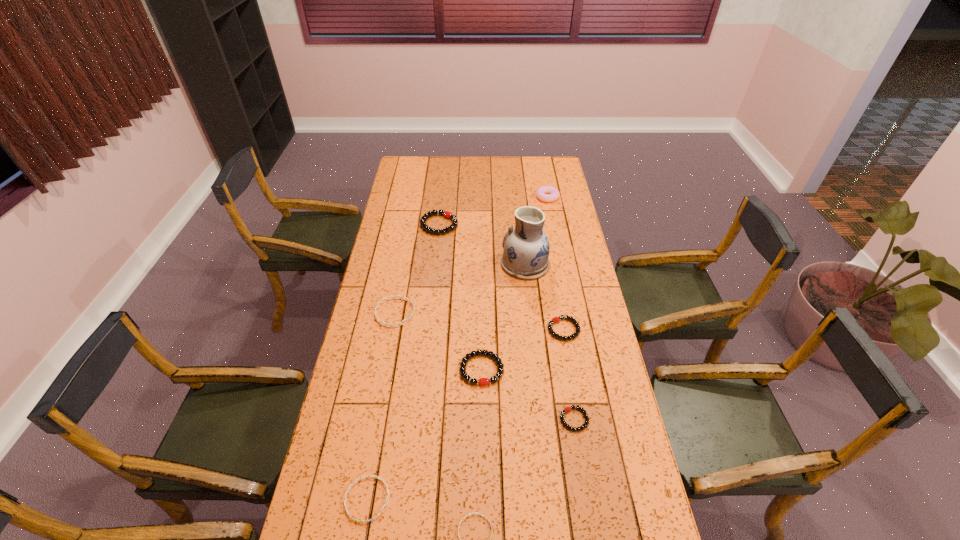
Find the location of a particular element. This screenshot has width=960, height=540. free space that satisfies the following two spatial constraints: 1. on the back side of the third biggest black bracelet; 2. on the left side of the doughnut is located at coordinates (540, 197).

Where is `free spot that satisfies the following two spatial constraints: 1. on the front side of the farthest bracelet; 2. on the surface of the biggest blue bracelet showing star-shaped elements`? The image size is (960, 540). free spot that satisfies the following two spatial constraints: 1. on the front side of the farthest bracelet; 2. on the surface of the biggest blue bracelet showing star-shaped elements is located at coordinates (429, 313).